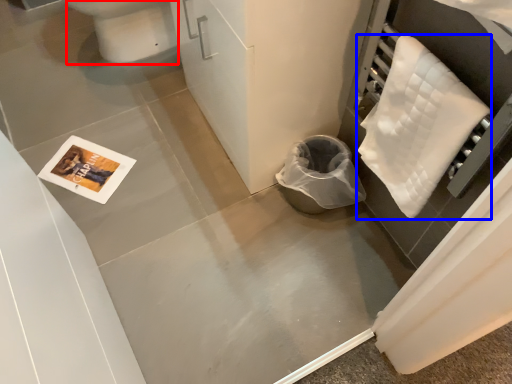
Question: Which of the following is the farthest to the observer, toilet bowl (highlighted by a red box) or cloth (highlighted by a blue box)?

Choices:
 (A) toilet bowl
 (B) cloth

Answer: (A)